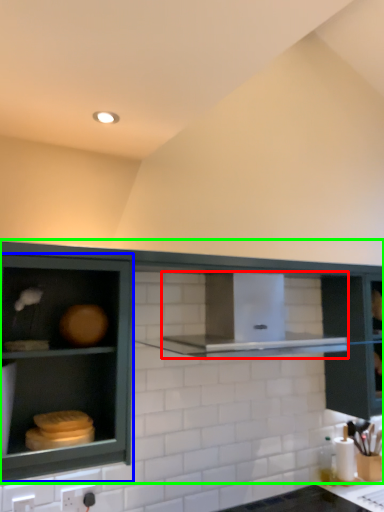
Question: Which is nearer to the vent (highlighted by a red box)? cabinetry (highlighted by a blue box) or cabinetry (highlighted by a green box).

Choices:
 (A) cabinetry
 (B) cabinetry

Answer: (B)